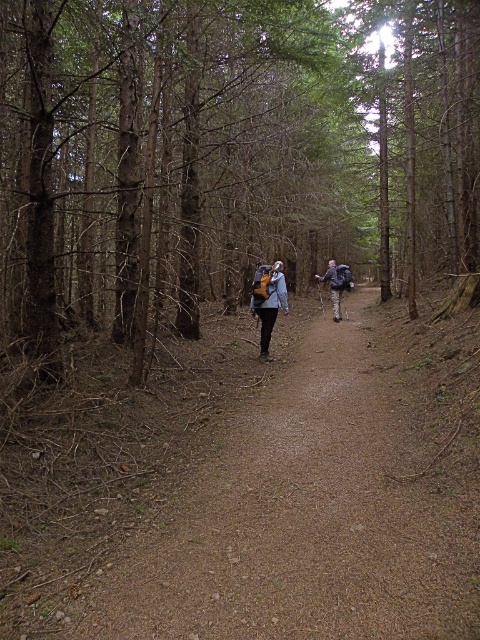
Question: Which point is farther from the camera taking this photo?

Choices:
 (A) (263, 305)
 (B) (310, 476)
 (C) (324, 273)
 (D) (192, 109)

Answer: (C)

Question: Can you confirm if dirt path at center is positioned to the left of matte gray jacket at center?

Choices:
 (A) yes
 (B) no

Answer: (B)

Question: Is brown bark tree at center below matte gray jacket at center?

Choices:
 (A) no
 (B) yes

Answer: (A)

Question: Which of these objects is positioned farthest from the brown bark tree at center?

Choices:
 (A) matte gray jacket at center
 (B) matte gray backpack at center
 (C) dirt path at center

Answer: (C)

Question: Which point is closer to the camera taking this photo?

Choices:
 (A) (336, 294)
 (B) (260, 304)

Answer: (B)

Question: Where is matte gray jacket at center located in relation to matte gray backpack at center in the image?

Choices:
 (A) above
 (B) below

Answer: (B)